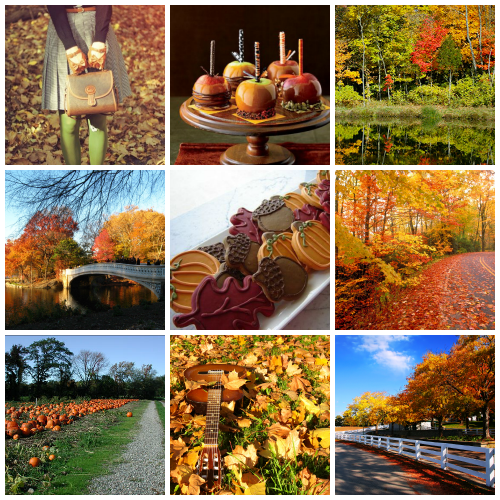
Find the location of a particular element. This screenshot has height=500, width=500. photographs is located at coordinates (148, 72), (238, 75), (393, 92), (78, 258), (390, 246), (216, 277), (113, 389), (280, 420), (442, 424).